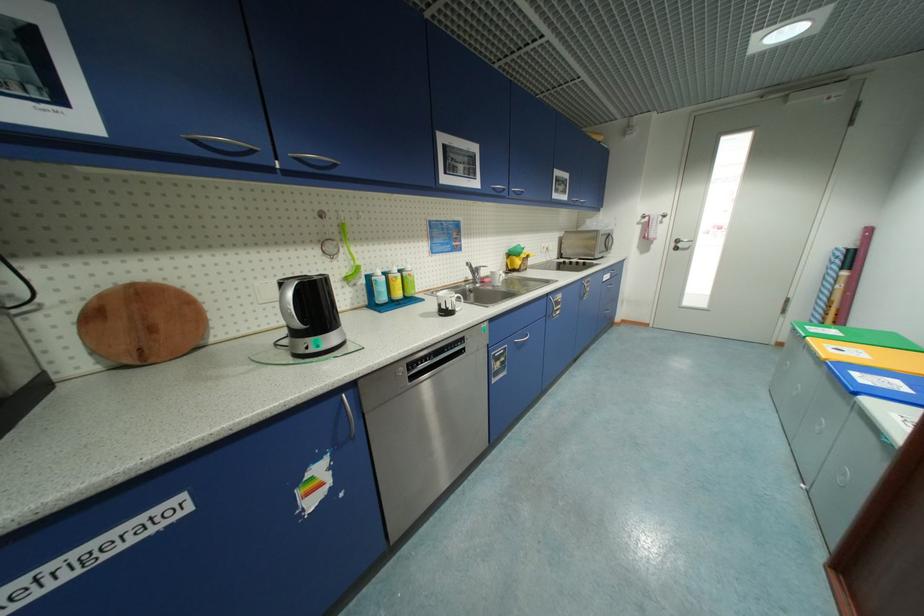
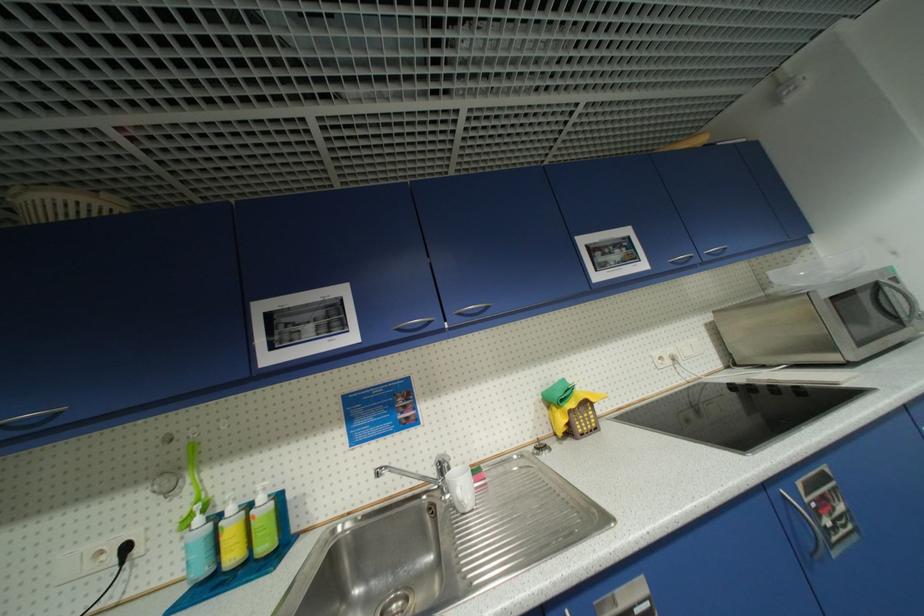
The point at (483, 286) is marked in the first image. Where is the corresponding point in the second image?

(454, 496)